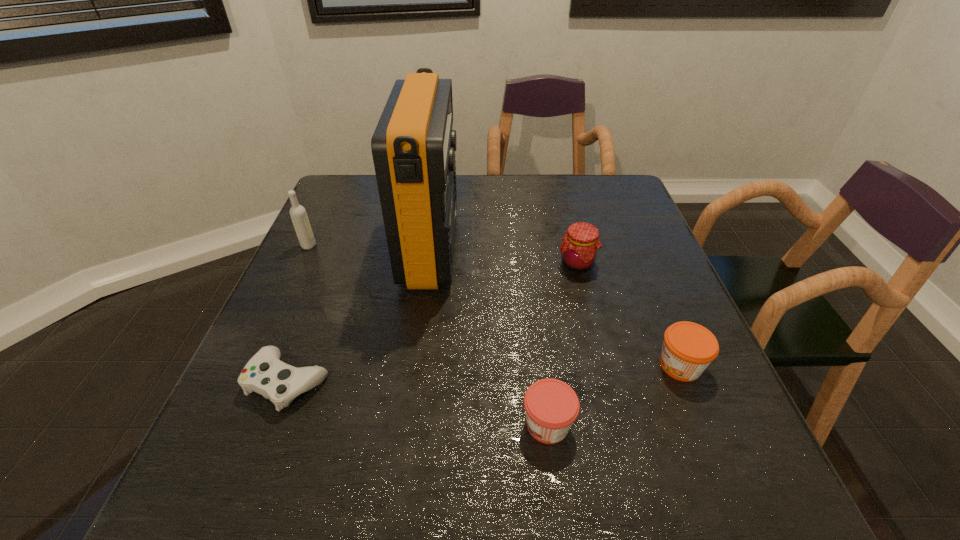
Where is `the tallest object`? The width and height of the screenshot is (960, 540). the tallest object is located at coordinates (413, 146).

Where is `radio receiver`? radio receiver is located at coordinates (413, 146).

The width and height of the screenshot is (960, 540). What are the coordinates of `vodka` in the screenshot? It's located at (298, 214).

The image size is (960, 540). I want to click on the tallest jam, so click(x=579, y=249).

Locate an element on the screen. Image resolution: width=960 pixels, height=540 pixels. the second object from right to left is located at coordinates (579, 249).

Locate an element on the screen. This screenshot has width=960, height=540. the rightmost object is located at coordinates (688, 348).

Identify the location of the second nearest jam. (688, 348).

Find the location of a particular element. This screenshot has height=540, width=960. the leftmost jam is located at coordinates (551, 406).

This screenshot has width=960, height=540. I want to click on the nearest jam, so click(551, 406).

The width and height of the screenshot is (960, 540). What are the coordinates of `control` in the screenshot? It's located at (265, 374).